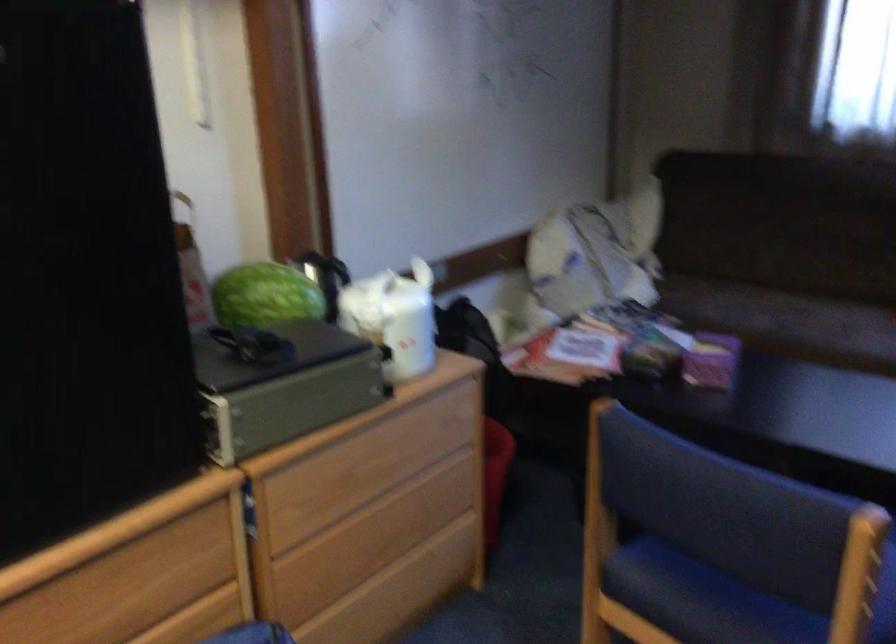
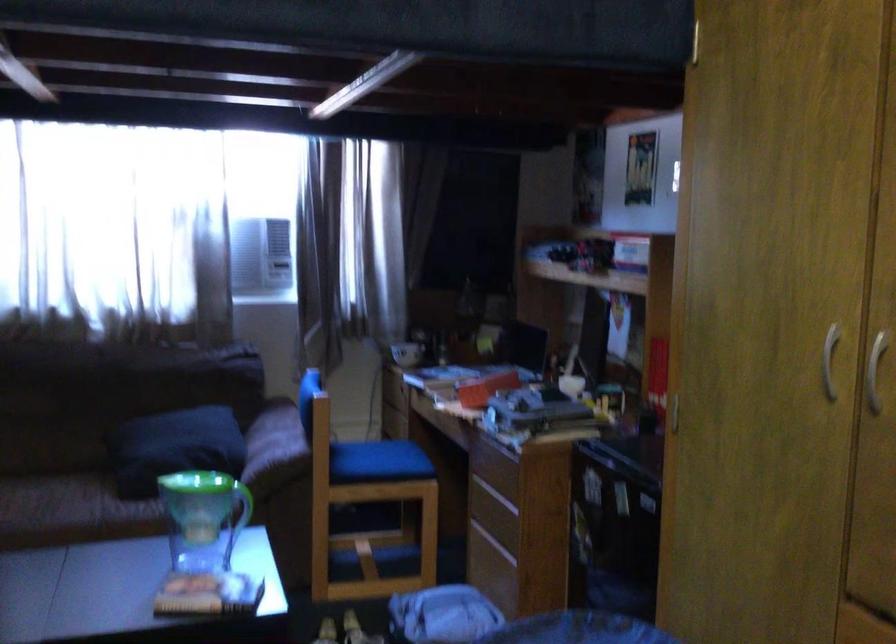
Question: Based on the continuous images, in which direction is the camera rotating? Reply with the corresponding letter.

Choices:
 (A) Left
 (B) Right
 (C) Up
 (D) Down

Answer: (B)